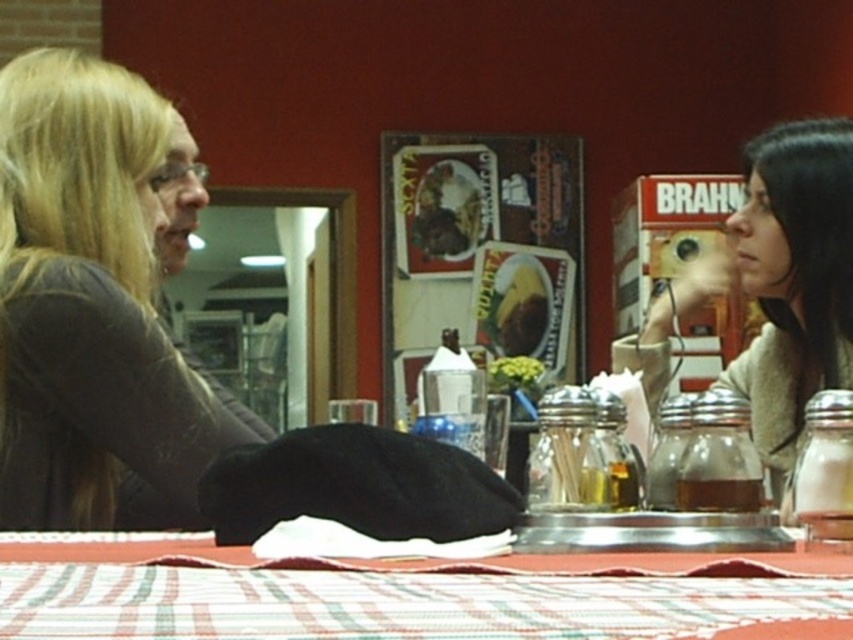
Which of these two, striped cotton tablecloth at center or beige fabric jacket at right, stands shorter?

Standing shorter between the two is striped cotton tablecloth at center.

This screenshot has height=640, width=853. What do you see at coordinates (412, 593) in the screenshot?
I see `striped cotton tablecloth at center` at bounding box center [412, 593].

Locate an element on the screen. Image resolution: width=853 pixels, height=640 pixels. striped cotton tablecloth at center is located at coordinates (412, 593).

Is point (131, 452) positioned behind point (808, 209)?

That is False.

Who is more distant from viewer, (91,388) or (749,264)?

Point (749,264)

Where is `dark gray sweater at left`? The image size is (853, 640). dark gray sweater at left is located at coordinates (91, 310).

Does dark gray sweater at left appear on the left side of striped cotton tablecloth at center?

Yes, dark gray sweater at left is to the left of striped cotton tablecloth at center.

Is dark gray sweater at left positioned in front of striped cotton tablecloth at center?

No, dark gray sweater at left is behind striped cotton tablecloth at center.

Image resolution: width=853 pixels, height=640 pixels. I want to click on dark gray sweater at left, so click(91, 310).